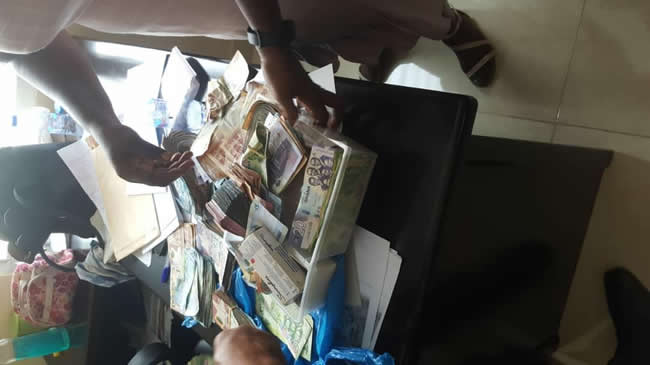
Identify the location of bin. The image size is (650, 365). click(355, 212).